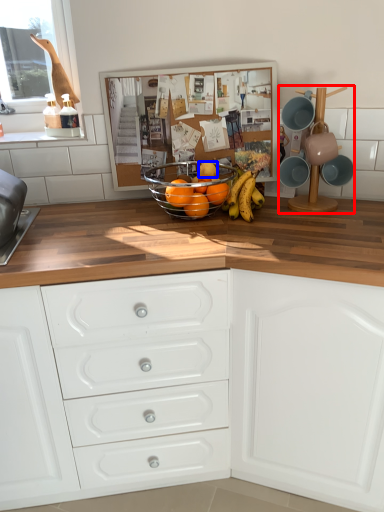
Question: Which of the following is the farthest to the observer, appliance (highlighted by a red box) or fruit (highlighted by a blue box)?

Choices:
 (A) appliance
 (B) fruit

Answer: (B)